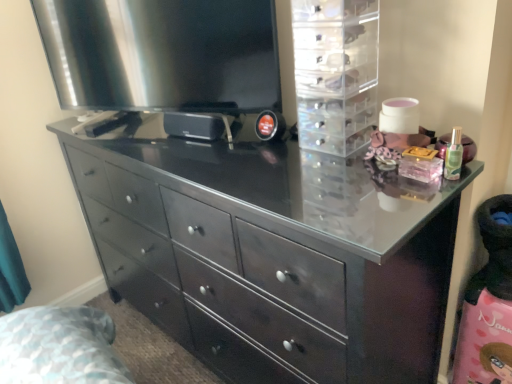
Question: Does transparent plastic drawers at upper right come behind black glossy chest of drawers at center?

Choices:
 (A) no
 (B) yes

Answer: (B)

Question: Is black glossy chest of drawers at center a part of transparent plastic drawers at upper right?

Choices:
 (A) no
 (B) yes

Answer: (A)

Question: From a real-world perspective, is transparent plastic drawers at upper right below black glossy chest of drawers at center?

Choices:
 (A) no
 (B) yes

Answer: (A)

Question: Is transparent plastic drawers at upper right outside black glossy chest of drawers at center?

Choices:
 (A) no
 (B) yes

Answer: (B)

Question: Does transparent plastic drawers at upper right have a greater height compared to black glossy chest of drawers at center?

Choices:
 (A) yes
 (B) no

Answer: (B)

Question: From a real-world perspective, is black glossy chest of drawers at center above or below transparent plastic drawers at upper right?

Choices:
 (A) below
 (B) above

Answer: (A)

Question: Is black glossy chest of drawers at center bigger or smaller than transparent plastic drawers at upper right?

Choices:
 (A) small
 (B) big

Answer: (B)

Question: Considering the positions of black glossy chest of drawers at center and transparent plastic drawers at upper right in the image, is black glossy chest of drawers at center taller or shorter than transparent plastic drawers at upper right?

Choices:
 (A) short
 (B) tall

Answer: (B)

Question: From the image's perspective, relative to transparent plastic drawers at upper right, is black glossy chest of drawers at center above or below?

Choices:
 (A) above
 (B) below

Answer: (B)

Question: From the image's perspective, relative to transparent plastic drawers at upper right, is satin black television at upper left above or below?

Choices:
 (A) below
 (B) above

Answer: (B)

Question: Visually, is satin black television at upper left positioned to the left or to the right of transparent plastic drawers at upper right?

Choices:
 (A) right
 (B) left

Answer: (B)

Question: Is satin black television at upper left in front of or behind transparent plastic drawers at upper right in the image?

Choices:
 (A) behind
 (B) front

Answer: (A)

Question: Considering the positions of point (x=252, y=59) and point (x=343, y=61), is point (x=252, y=59) closer or farther from the camera than point (x=343, y=61)?

Choices:
 (A) farther
 (B) closer

Answer: (A)

Question: Considering the positions of transparent plastic drawers at upper right and satin black television at upper left in the image, is transparent plastic drawers at upper right wider or thinner than satin black television at upper left?

Choices:
 (A) thin
 (B) wide

Answer: (B)

Question: From a real-world perspective, is transparent plastic drawers at upper right physically located above or below satin black television at upper left?

Choices:
 (A) below
 (B) above

Answer: (A)